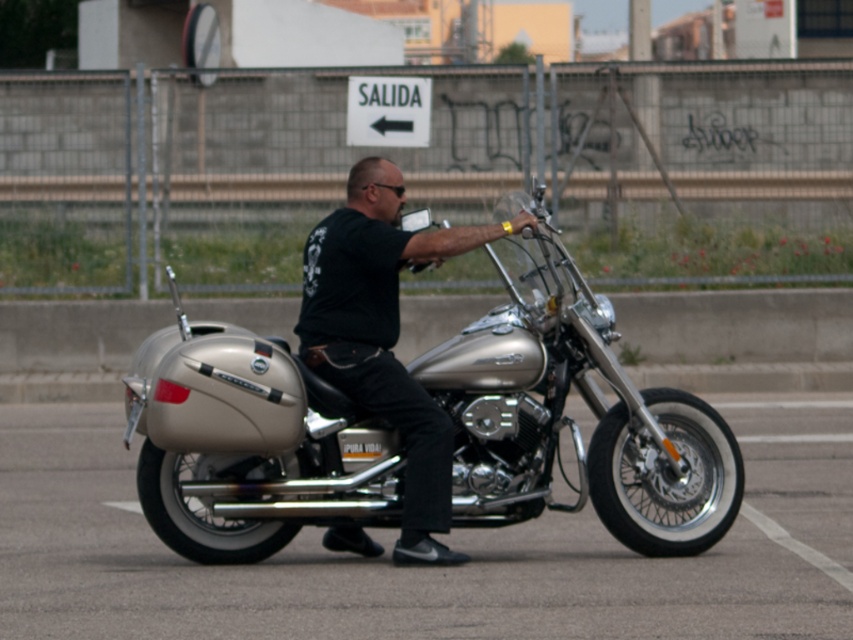
Based on the photo, you are a traffic officer observing the scene. The metallic silver motorcycle at center is positioned at coordinates. Can you determine if it is parked legally within the designated parking area, which is marked from coordinates 0.7 to 0.9 along the x and y axes?

The metallic silver motorcycle at center is located at point (426, 568). Since the parking area is from 0.7 to 0.9 along both axes, the motorcycle is within the designated parking area as its coordinates fall within the specified range.

You are standing at the origin point of the coordinate system. The metallic silver motorcycle at center is located at point (426, 568). If you want to move towards the motorcycle, in which direction should you move?

The metallic silver motorcycle at center is located at point (426, 568), so you should move in the positive x and y direction to reach it.

You are a delivery person who needs to park your metallic silver motorcycle at center and silver metallic motorcycle at center in a parking spot that is 8 feet wide. Can both motorcycles fit side by side in the parking spot?

The metallic silver motorcycle at center and silver metallic motorcycle at center are 4.56 feet apart. Since the parking spot is 8 feet wide, which is more than double the distance between the motorcycles, both motorcycles can fit side by side in the parking spot.